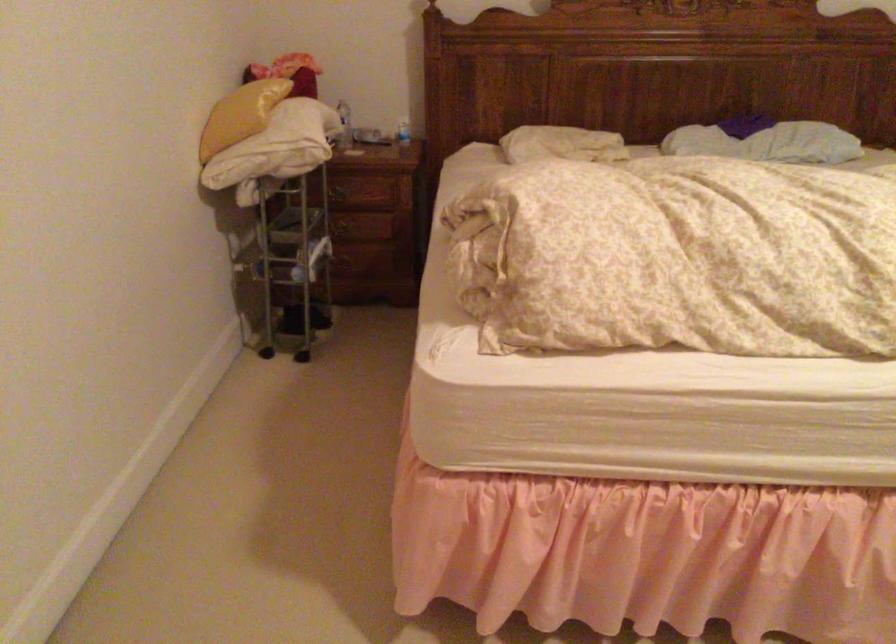
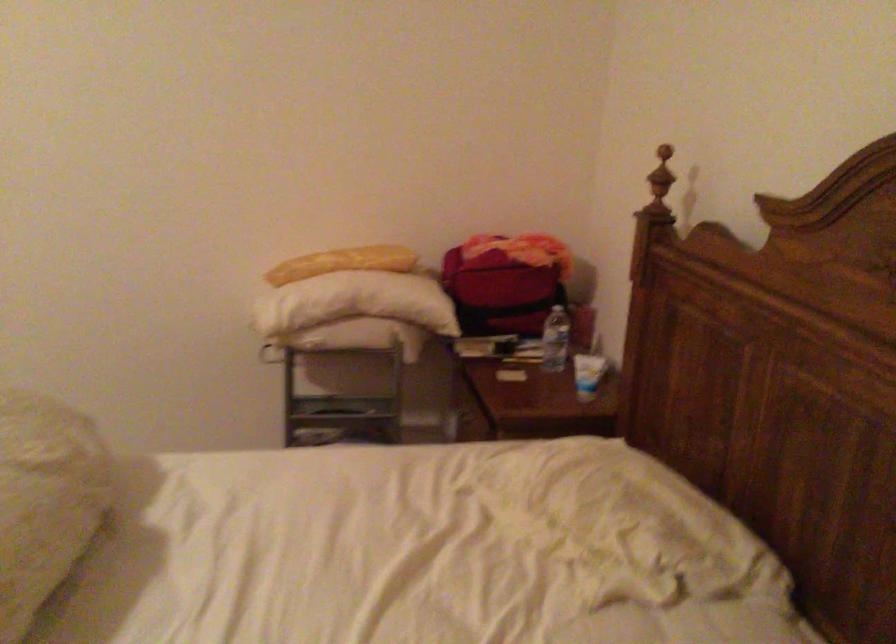
Question: I am providing you with two images of the same scene from different viewpoints. After the viewpoint changes to image2, which objects are now occluded?

Choices:
 (A) green round bin
 (B) long yellow bread
 (C) drawer handle
 (D) red bag

Answer: (C)